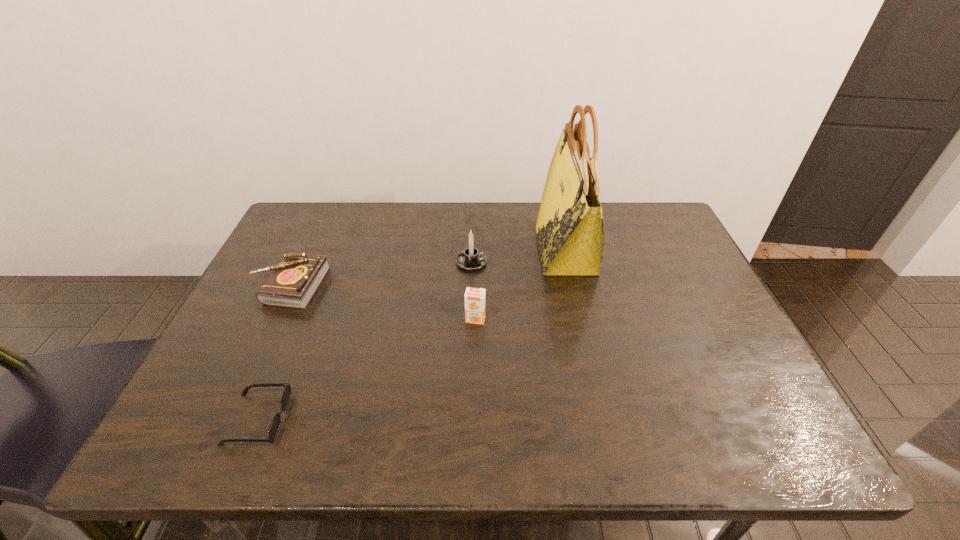
You are a GUI agent. You are given a task and a screenshot of the screen. Output one action in this format:
    pyautogui.click(x=<x>, y=<y>)
    Task: Click on the free space between the tote bag and the second shortest object
    The height and width of the screenshot is (540, 960).
    Given the screenshot: What is the action you would take?
    pyautogui.click(x=428, y=268)

The width and height of the screenshot is (960, 540). In order to click on free space between the diary and the sunglasses in this screenshot , I will do coord(274,352).

Where is `vacant point located between the shortest object and the fourth tallest object`? The image size is (960, 540). vacant point located between the shortest object and the fourth tallest object is located at coordinates (274, 352).

You are a GUI agent. You are given a task and a screenshot of the screen. Output one action in this format:
    pyautogui.click(x=<x>, y=<y>)
    Task: Click on the empty space that is in between the tote bag and the second shortest object
    This screenshot has height=540, width=960.
    Given the screenshot: What is the action you would take?
    pyautogui.click(x=428, y=268)

Where is `object that is the closest to the tote bag`? The width and height of the screenshot is (960, 540). object that is the closest to the tote bag is located at coordinates (470, 259).

Locate an element on the screen. the fourth closest object to the candle holder is located at coordinates (275, 425).

Identify the location of vacant region that satisfies the following two spatial constraints: 1. with a handle on the side of the candle holder; 2. on the front side of the diary. The image size is (960, 540). (471, 286).

At what (x,y) coordinates should I click in order to perform the action: click on vacant point that satisfies the following two spatial constraints: 1. with a handle on the side of the third shortest object; 2. on the right side of the second tallest object. Please return your answer as a coordinate pair (x, y). Looking at the image, I should click on (470, 319).

The image size is (960, 540). In order to click on free spot that satisfies the following two spatial constraints: 1. on the front side of the fourth farthest object; 2. on the left side of the diary in this screenshot , I will do `click(274, 319)`.